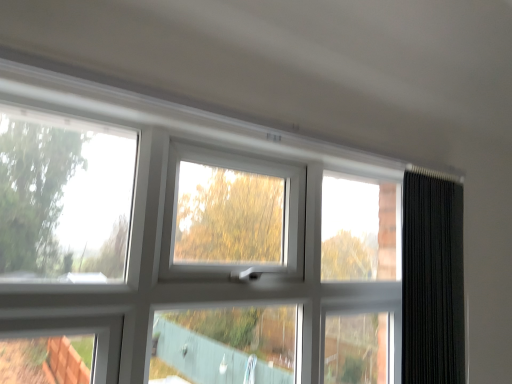
Question: Should I look upward or downward to see black textured curtain at right?

Choices:
 (A) up
 (B) down

Answer: (B)